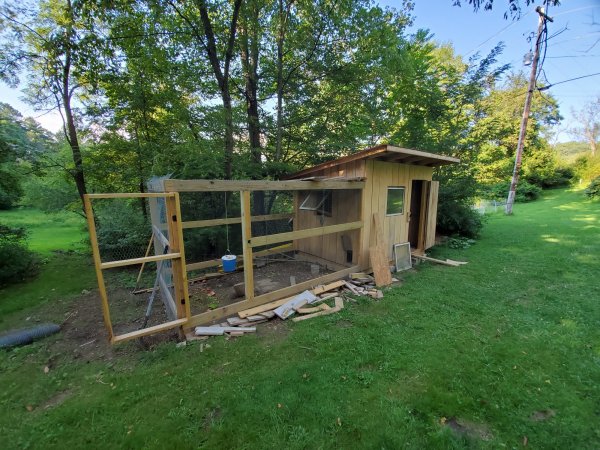
Find the location of a particular element. The width and height of the screenshot is (600, 450). 1 door is located at coordinates (432, 216).